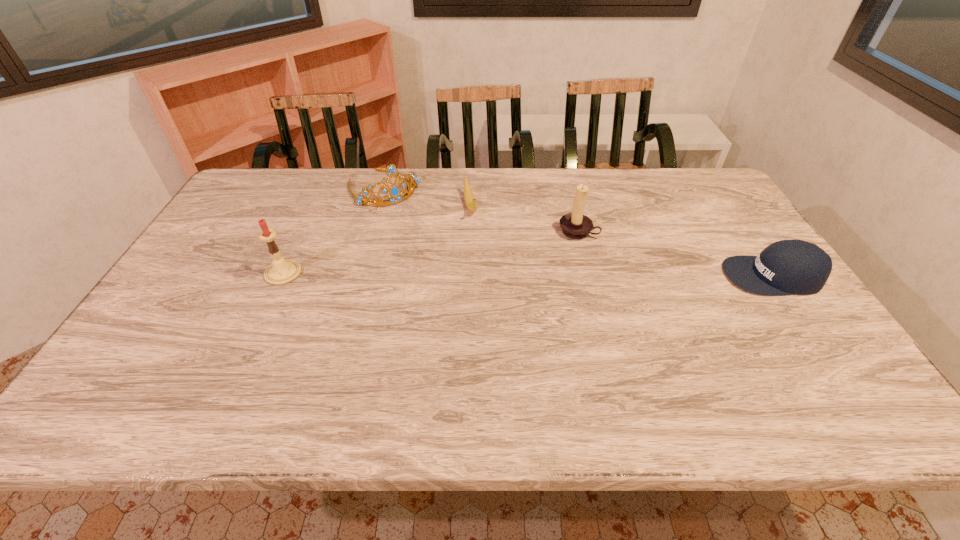
The width and height of the screenshot is (960, 540). I want to click on free space that is in between the candle holder and the banana, so click(524, 219).

Identify the location of unoccupied position between the leftmost object and the candle holder. The image size is (960, 540). (431, 252).

Find the location of a particular element. free space between the rightmost object and the second object from right to left is located at coordinates (675, 253).

Where is `vacant space that's between the candle and the candle holder`? vacant space that's between the candle and the candle holder is located at coordinates (431, 252).

This screenshot has width=960, height=540. Identify the location of vacant region between the candle holder and the candle. (431, 252).

Identify the location of unoccupied position between the second object from left to right and the candle holder. This screenshot has height=540, width=960. (481, 210).

What are the coordinates of `free space between the fourth object from left to right and the shortest object` in the screenshot? It's located at (524, 219).

Locate an element on the screen. object that is the fourth nearest to the tiara is located at coordinates (785, 267).

Locate which object ranks second in proximity to the third object from right to left. Please provide its 2D coordinates. Your answer should be formatted as a tuple, i.e. [(x, y)], where the tuple contains the x and y coordinates of a point satisfying the conditions above.

[(575, 225)]

Find the location of a particular element. The height and width of the screenshot is (540, 960). vacant region that satisfies the following two spatial constraints: 1. on the front side of the baseball cap; 2. on the front-facing side of the candle holder is located at coordinates (589, 276).